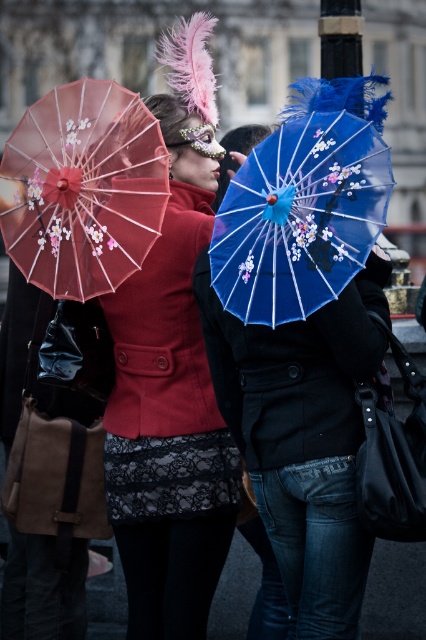
Looking at this image, does matte pink parasol at left have a lesser height compared to blue glossy parasol at center?

Incorrect, matte pink parasol at left's height does not fall short of blue glossy parasol at center's.

Is point (69, 132) positioned after point (339, 241)?

Yes.

The height and width of the screenshot is (640, 426). Identify the location of matte pink parasol at left. (83, 188).